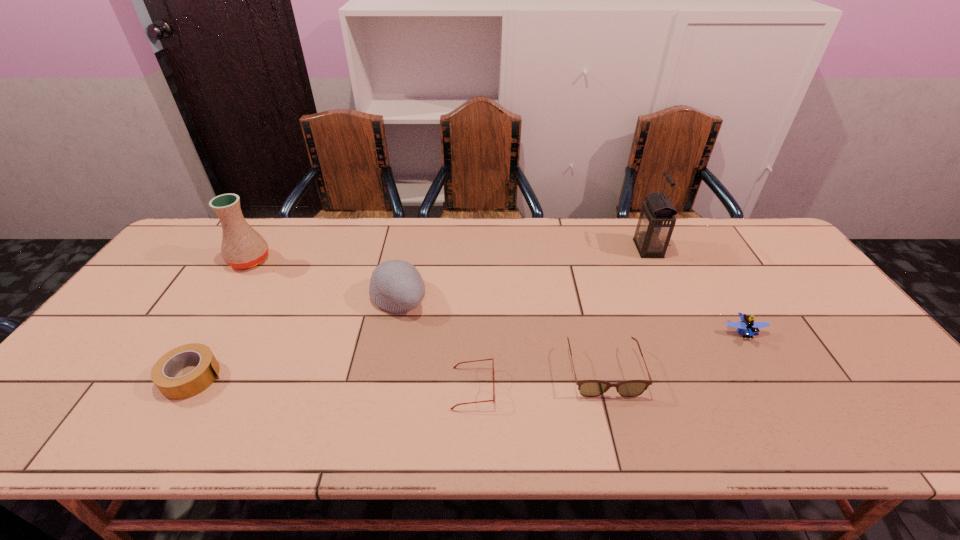
Image resolution: width=960 pixels, height=540 pixels. What are the coordinates of `vacant region that satisfies the following two spatial constraints: 1. on the front-facing side of the Lego; 2. at the edge of the duct tape` in the screenshot? It's located at (770, 377).

What are the coordinates of `vacant space that satisfies the following two spatial constraints: 1. on the front-facing side of the rightmost object; 2. on the face of the left spectacles` in the screenshot? It's located at (777, 388).